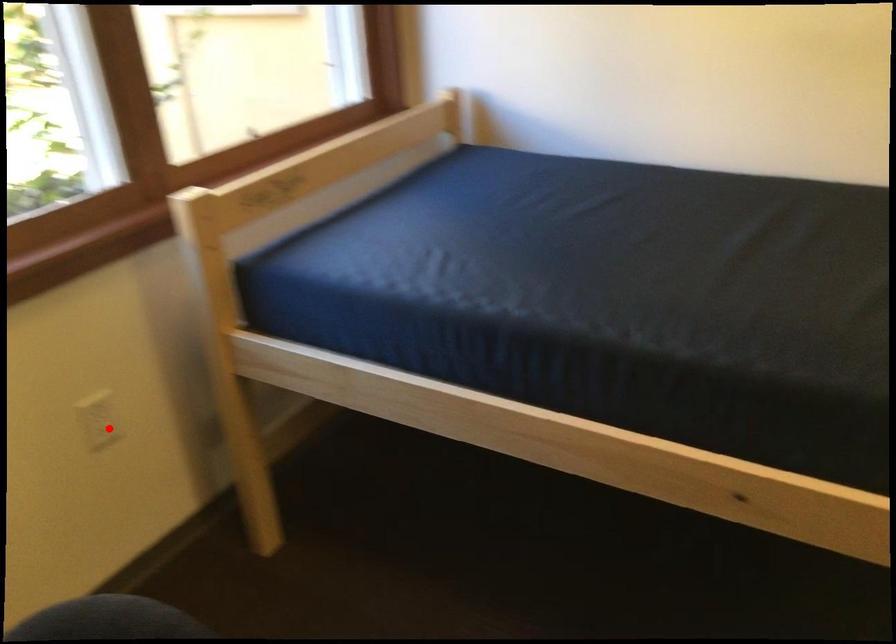
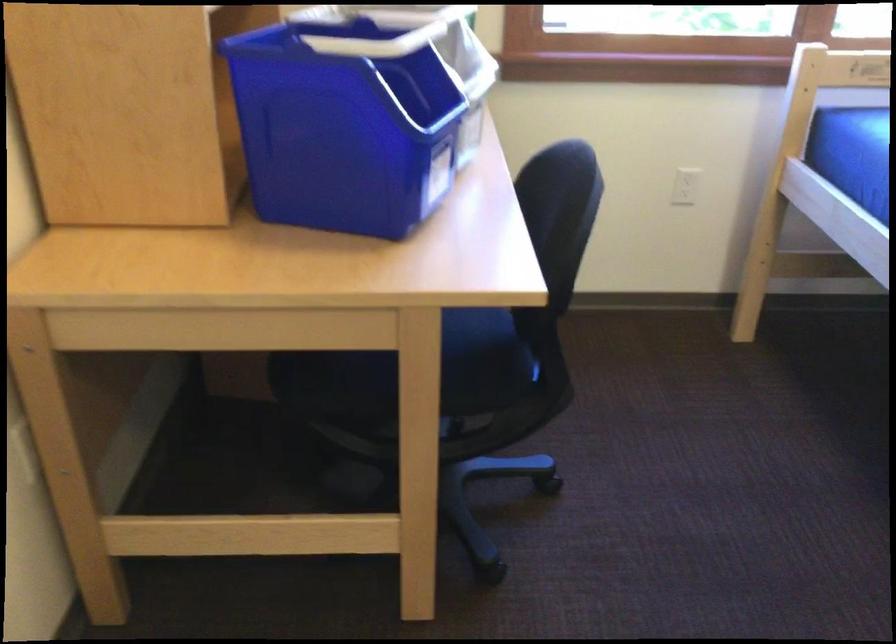
In the second image, find the point that corresponds to the highlighted location in the first image.

(683, 187)